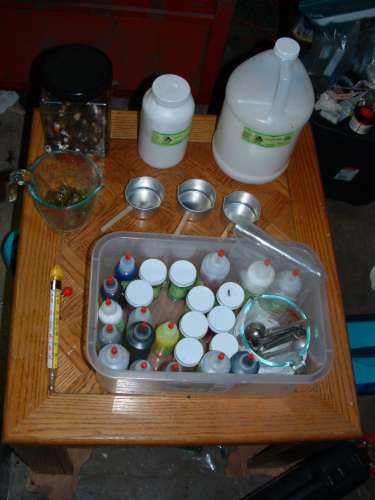
I want to click on glass measuring cups, so click(62, 220), click(294, 359).